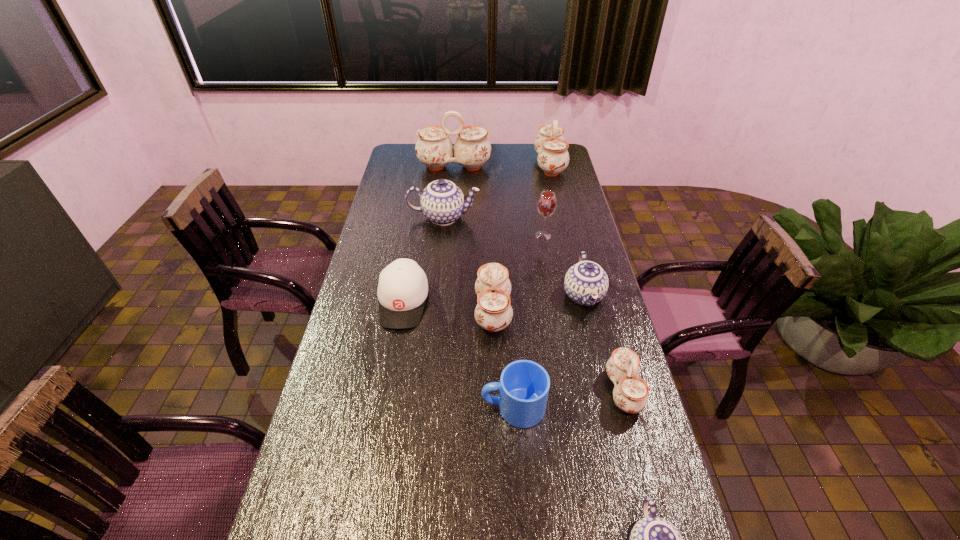
The image size is (960, 540). Find the location of `free space that is in between the second smallest blue chinaware and the second tallest chinaware`. free space that is in between the second smallest blue chinaware and the second tallest chinaware is located at coordinates (566, 230).

At what (x,y) coordinates should I click in order to perform the action: click on vacant area between the smallest white chinaware and the biggest white chinaware. Please return your answer as a coordinate pair (x, y). The height and width of the screenshot is (540, 960). Looking at the image, I should click on (539, 279).

Where is `vacant area that lies between the smallest white chinaware and the fifth nearest chinaware`? vacant area that lies between the smallest white chinaware and the fifth nearest chinaware is located at coordinates (534, 304).

Where is `blank region between the second nearest blue chinaware and the fifth nearest chinaware`? The height and width of the screenshot is (540, 960). blank region between the second nearest blue chinaware and the fifth nearest chinaware is located at coordinates [x=514, y=256].

This screenshot has width=960, height=540. Identify the location of vacant area between the tallest object and the second tallest chinaware. (502, 166).

Where is `object that stands as the second closest to the baseball cap`? The height and width of the screenshot is (540, 960). object that stands as the second closest to the baseball cap is located at coordinates (524, 385).

Locate which object is the second closest to the mug. Please provide its 2D coordinates. Your answer should be formatted as a tuple, i.e. [(x, y)], where the tuple contains the x and y coordinates of a point satisfying the conditions above.

[(631, 394)]

Identify which chinaware is the closest to the fourth farthest object. Please provide its 2D coordinates. Your answer should be formatted as a tuple, i.e. [(x, y)], where the tuple contains the x and y coordinates of a point satisfying the conditions above.

[(586, 283)]

The image size is (960, 540). I want to click on the third closest chinaware to the third farthest object, so coord(553,157).

Identify which white chinaware is the third closest to the red wineglass. Please provide its 2D coordinates. Your answer should be formatted as a tuple, i.e. [(x, y)], where the tuple contains the x and y coordinates of a point satisfying the conditions above.

[(472, 148)]